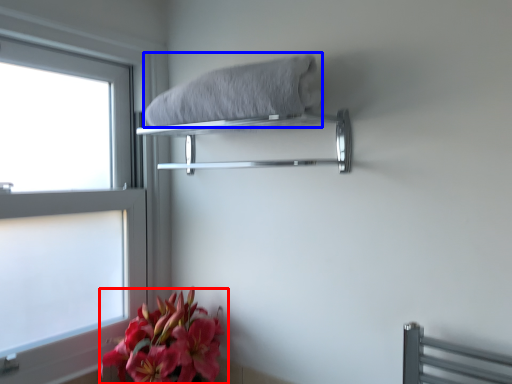
Question: Among these objects, which one is nearest to the camera, flower (highlighted by a red box) or bath towel (highlighted by a blue box)?

Choices:
 (A) flower
 (B) bath towel

Answer: (B)